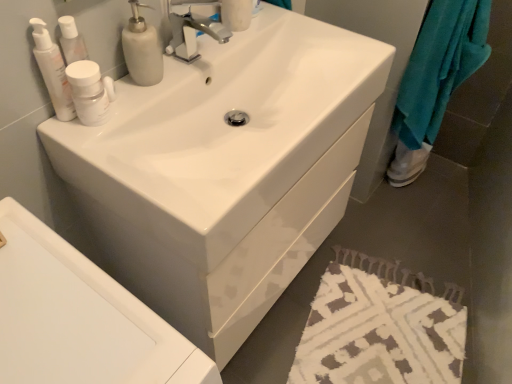
At what (x,y) coordinates should I click in order to perform the action: click on vacant space in front of white matte bottle at upper left, which appears as the 1th mouthwash when viewed from the right. Please return your answer as a coordinate pair (x, y). Image resolution: width=512 pixels, height=384 pixels. Looking at the image, I should click on (105, 160).